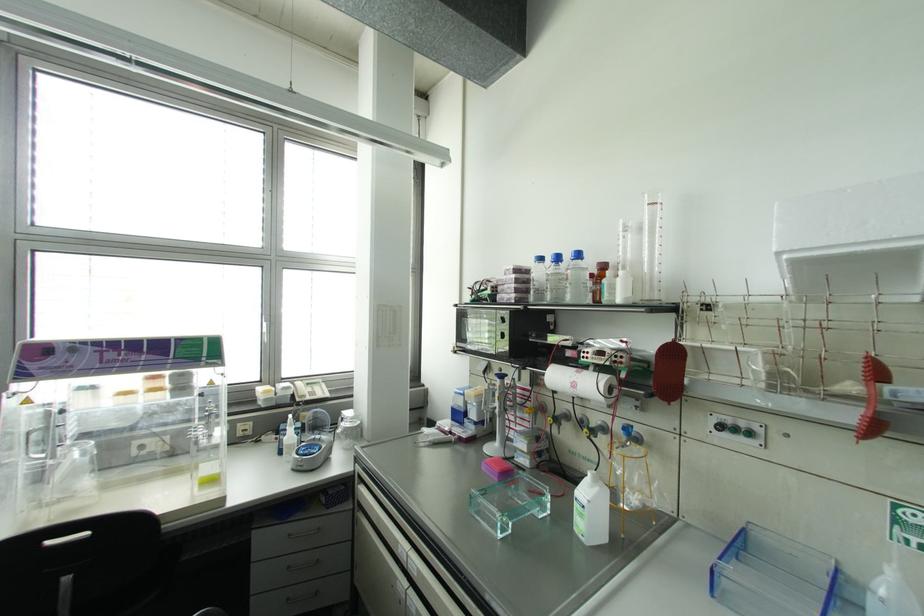
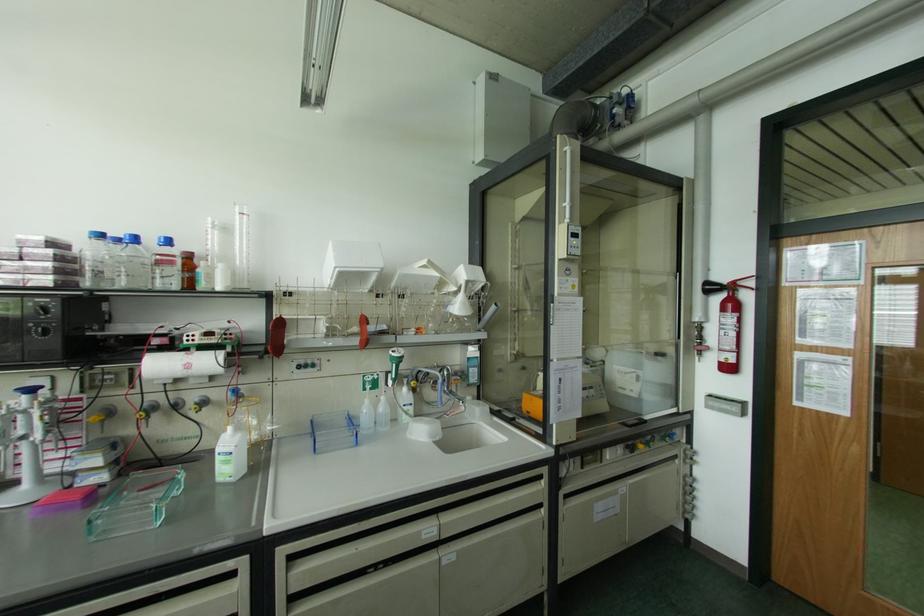
The point at (578, 254) is marked in the first image. Where is the corresponding point in the second image?

(167, 241)